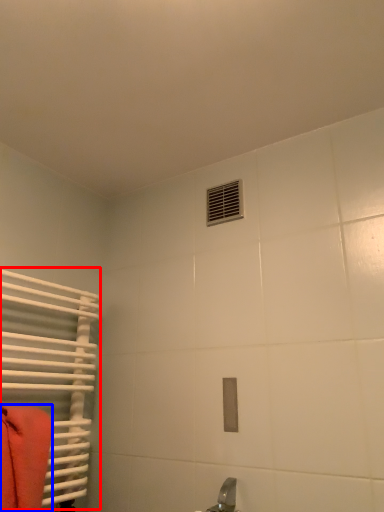
Question: Which object appears closest to the camera in this image, radiator (highlighted by a red box) or towel (highlighted by a blue box)?

Choices:
 (A) radiator
 (B) towel

Answer: (B)